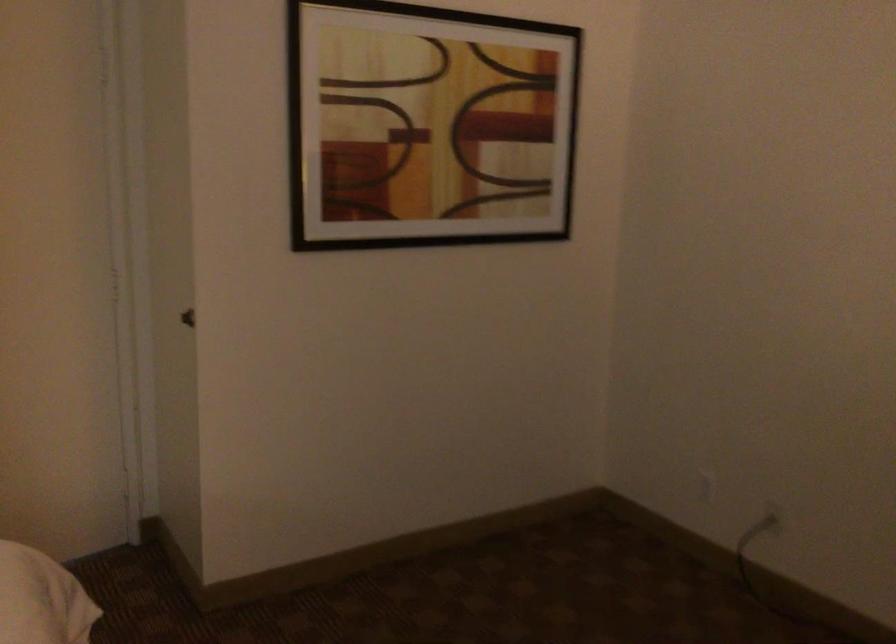
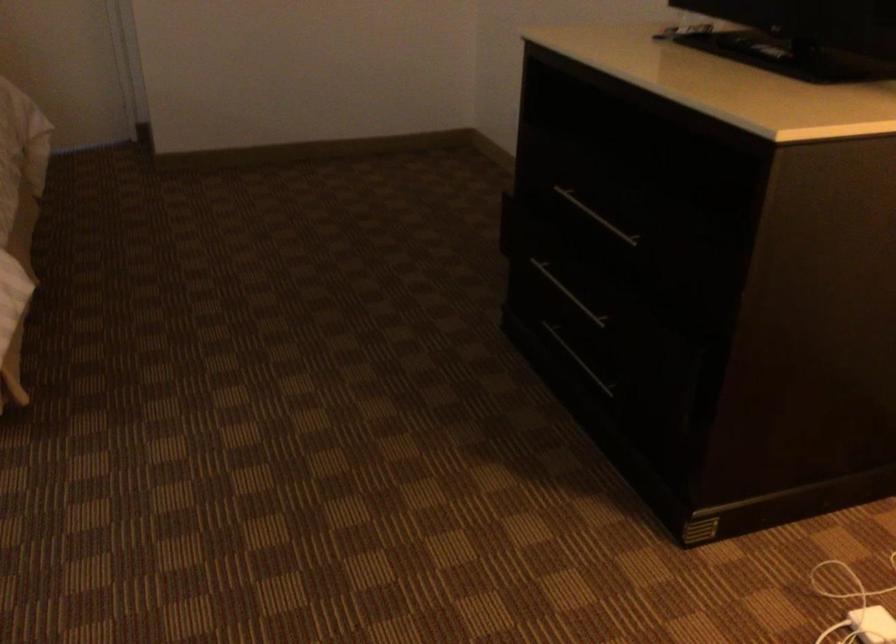
Question: I am providing you with two images of the same scene from different viewpoints. Please identify which objects are invisible in image2.

Choices:
 (A) cardboard file holder
 (B) silver drawer handle
 (C) power cord plug
 (D) white power adapter

Answer: (C)